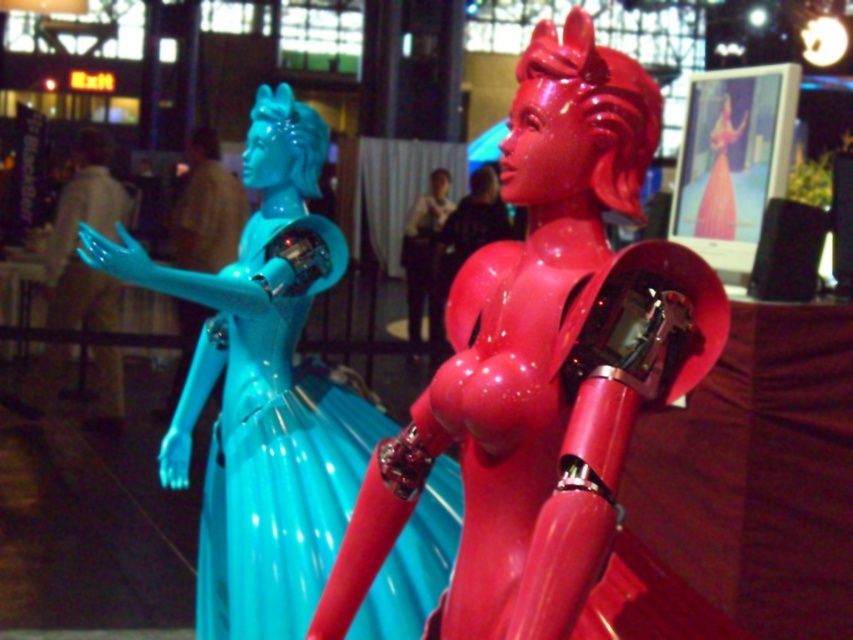
You are standing in front of the two futuristic sculptures in the exhibition space. You notice two points marked on the sculptures. The first point is at coordinates point (573, 596) and the second point is at point (434, 323). Which of these two points is closer to your viewpoint?

Point (573, 596) is closer to the camera than point (434, 323), so the first point is closer to your viewpoint.

You are an art curator planning to display both the glossy plastic statue at left and the glossy plastic woman at center in a new gallery. The gallery has a narrow corridor that can only accommodate items up to 1.2 meters in width. Which sculpture should you choose to display in the corridor to ensure it fits?

The glossy plastic woman at center should be chosen because its width is smaller than the glossy plastic statue at left, making it suitable for the narrow corridor with a 1.2 meters width limit.

You are an art curator preparing to install these sculptures in a new gallery layout. The glossy plastic doll at center and the glossy plastic statue at left need to be placed exactly 20 inches apart. Based on the current spacing between them, will you need to move them closer together or farther apart to meet this requirement?

The glossy plastic doll at center is currently 20.16 inches from the glossy plastic statue at left. To meet the 20 inches requirement, you need to move them slightly closer together by 0.16 inches.